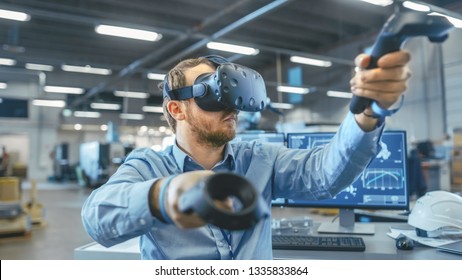
At what (x,y) coordinates should I click in order to perform the action: click on computer screen. Please return your answer as a coordinate pair (x, y). Looking at the image, I should click on (379, 165).